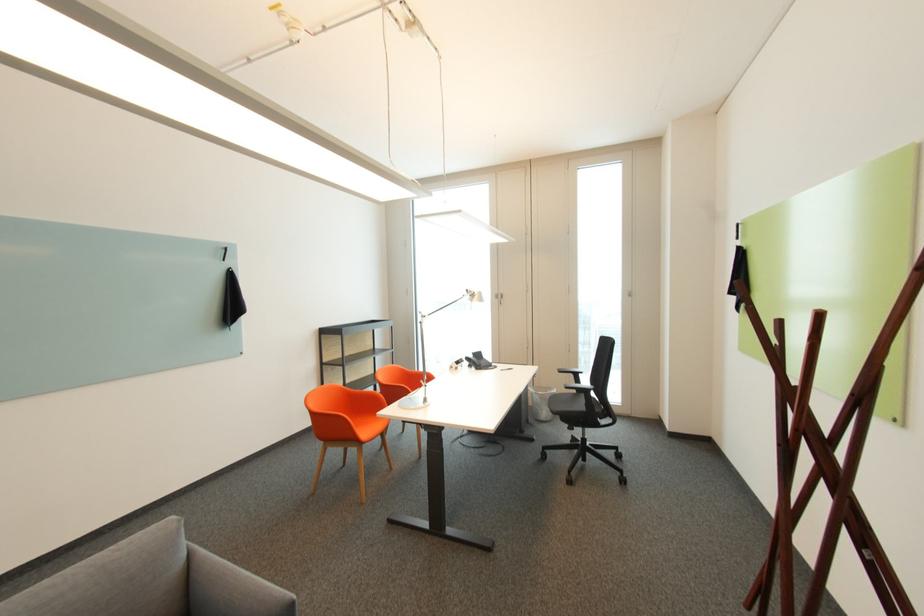
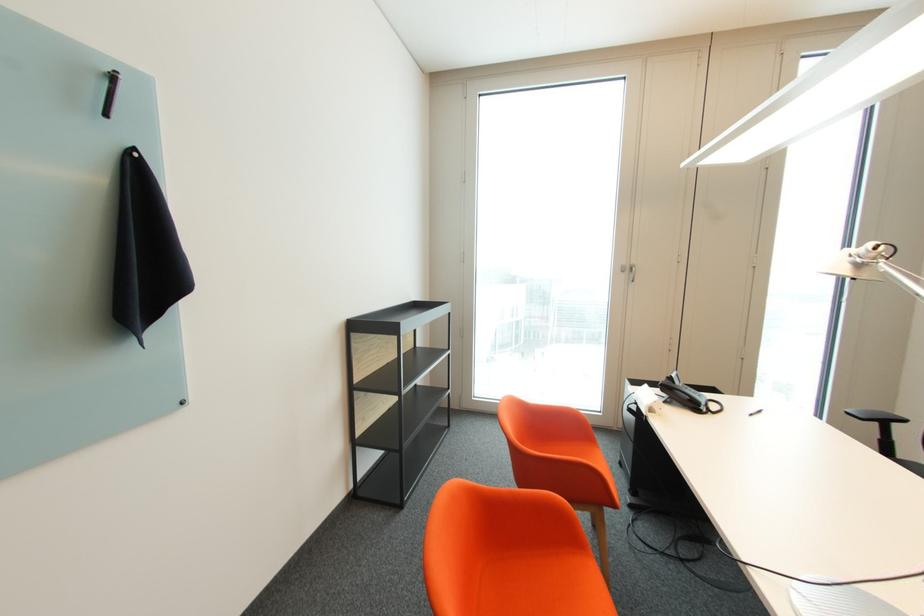
Where in the second image is the point corresponding to (504,299) from the first image?

(629, 272)